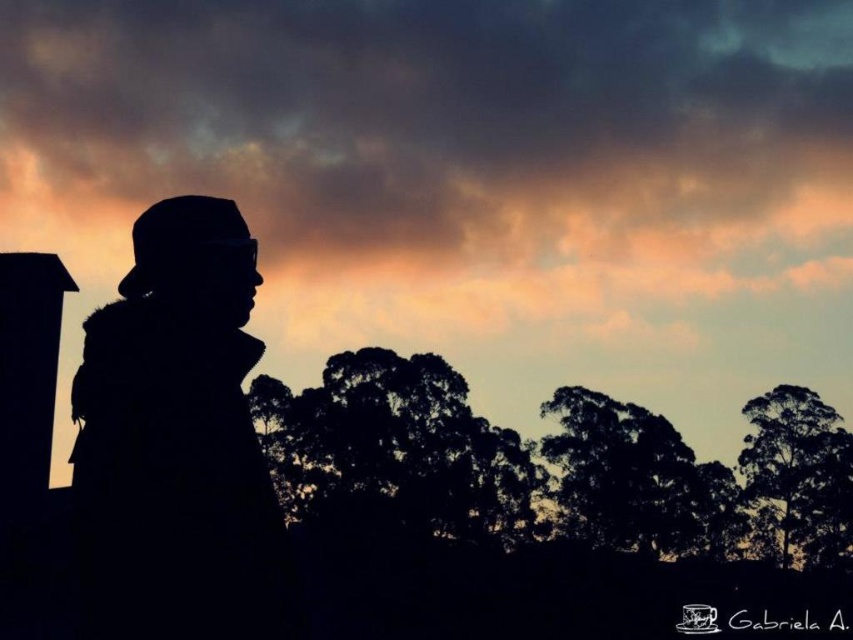
Question: Which object appears closest to the camera in this image?

Choices:
 (A) orange sky at upper center
 (B) silhouette leafy tree at center
 (C) silhouette tree at right
 (D) silhouette tree at center

Answer: (B)

Question: Can you confirm if silhouette hat at left is positioned above silhouette tree at center?

Choices:
 (A) no
 (B) yes

Answer: (B)

Question: Can you confirm if silhouette leafy tree at center is bigger than silhouette tree at right?

Choices:
 (A) no
 (B) yes

Answer: (B)

Question: Which point is closer to the camera taking this photo?

Choices:
 (A) (389, 435)
 (B) (436, 244)
 (C) (241, 577)
 (D) (602, 419)

Answer: (C)

Question: Does orange sky at upper center have a greater width compared to silhouette hat at left?

Choices:
 (A) yes
 (B) no

Answer: (A)

Question: Which point is farther to the camera?

Choices:
 (A) (643, 458)
 (B) (590, 324)
 (C) (782, 433)

Answer: (B)